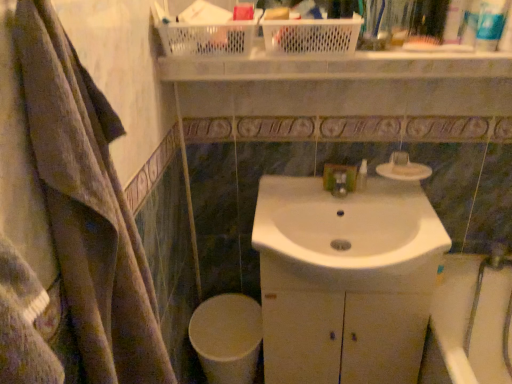
Question: From the image's perspective, is white matte soap at upper center located above or below white glossy sink at center?

Choices:
 (A) below
 (B) above

Answer: (B)

Question: Visually, is white matte soap at upper center positioned to the left or to the right of white glossy sink at center?

Choices:
 (A) right
 (B) left

Answer: (A)

Question: Which is nearer to the white glossy sink at center?

Choices:
 (A) white glossy bath at lower right
 (B) white plastic basket at upper center
 (C) white glossy toilet bowl at lower center
 (D) white plastic basket at upper center, which is the 2th basket from left to right
 (E) white plastic toothpaste tube at upper right, the second toiletry from the bottom

Answer: (A)

Question: Based on their relative distances, which object is farther from the white plastic basket at upper center, which is the 2th basket from left to right?

Choices:
 (A) translucent plastic bottle at upper right, acting as the first toiletry starting from the top
 (B) white glossy cabinet at center
 (C) white plastic basket at upper center
 (D) white plastic basket at upper center, the first basket positioned from the left
 (E) white matte soap at upper center

Answer: (B)